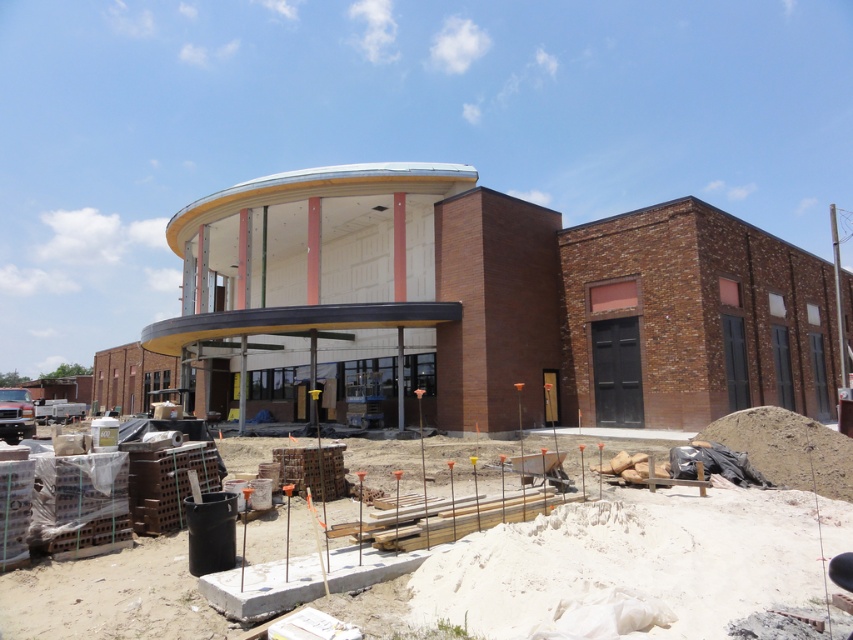
Question: Does white smooth building at center appear on the right side of concrete blocks at lower left?

Choices:
 (A) yes
 (B) no

Answer: (A)

Question: Which of the following is the farthest from the observer?

Choices:
 (A) white smooth building at center
 (B) concrete blocks at lower left

Answer: (A)

Question: Does white smooth building at center appear on the right side of concrete blocks at lower left?

Choices:
 (A) yes
 (B) no

Answer: (A)

Question: Among these points, which one is farthest from the camera?

Choices:
 (A) (424, 330)
 (B) (693, 579)

Answer: (A)

Question: From the image, what is the correct spatial relationship of white smooth building at center in relation to concrete blocks at lower left?

Choices:
 (A) below
 (B) above

Answer: (B)